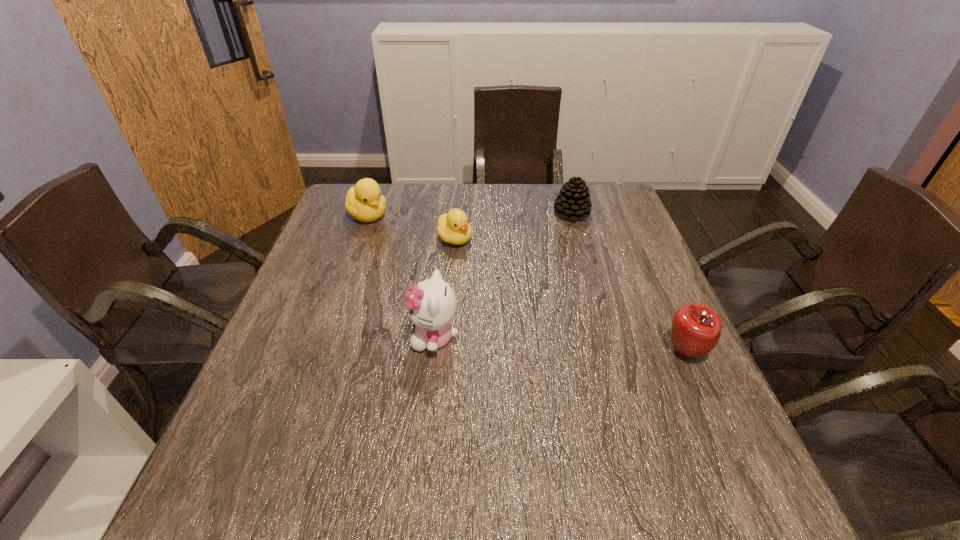
Where is `kitten`? This screenshot has height=540, width=960. kitten is located at coordinates [431, 306].

Image resolution: width=960 pixels, height=540 pixels. Find the location of `the rightmost object`. the rightmost object is located at coordinates (696, 328).

The image size is (960, 540). Find the location of `duck`. duck is located at coordinates (364, 202).

The image size is (960, 540). What are the coordinates of `the second object from right to left` in the screenshot? It's located at (573, 201).

Locate an element on the screen. This screenshot has width=960, height=540. the shortest object is located at coordinates (453, 227).

This screenshot has height=540, width=960. Identify the location of duckling. (453, 227).

Locate an element on the screen. This screenshot has width=960, height=540. free spot located on the front-facing side of the kitten is located at coordinates (299, 337).

At what (x,y) coordinates should I click in order to perform the action: click on free space located 0.260m on the front-facing side of the kitten. Please return your answer as a coordinate pair (x, y). Looking at the image, I should click on [x=294, y=337].

I want to click on vacant area situated on the front-facing side of the kitten, so click(x=312, y=337).

This screenshot has width=960, height=540. Identify the location of vacant space located on the left of the rightmost object. (479, 352).